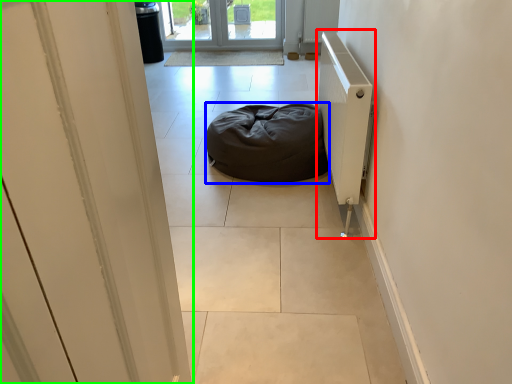
Question: Considering the real-world distances, which object is farthest from radiator (highlighted by a red box)? furniture (highlighted by a blue box) or door (highlighted by a green box)?

Choices:
 (A) furniture
 (B) door

Answer: (B)